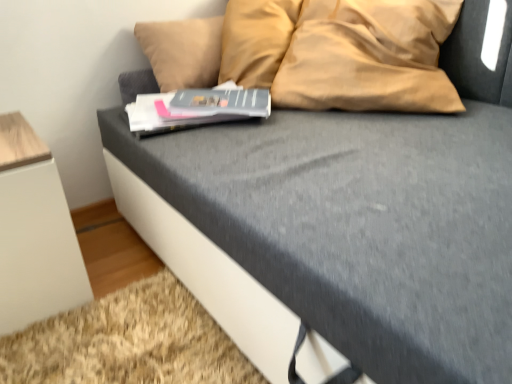
Question: In terms of width, does matte gray paperback book at center, marked as the 2th paperback book in a front-to-back arrangement, look wider or thinner when compared to white matte cabinet at lower left?

Choices:
 (A) thin
 (B) wide

Answer: (A)

Question: Considering their positions, is matte gray paperback book at center, marked as the 2th paperback book in a front-to-back arrangement, located in front of or behind white matte cabinet at lower left?

Choices:
 (A) behind
 (B) front

Answer: (A)

Question: Which object is the farthest from the white matte cabinet at lower left?

Choices:
 (A) matte gray paperback book at center, arranged as the 1th paperback book when viewed from the back
 (B) hardcover book at center, which is the 1th paperback book from front to back

Answer: (A)

Question: Which object is positioned farthest from the matte gray paperback book at center, marked as the 2th paperback book in a front-to-back arrangement?

Choices:
 (A) white matte cabinet at lower left
 (B) hardcover book at center, arranged as the second paperback book when viewed from the back

Answer: (A)